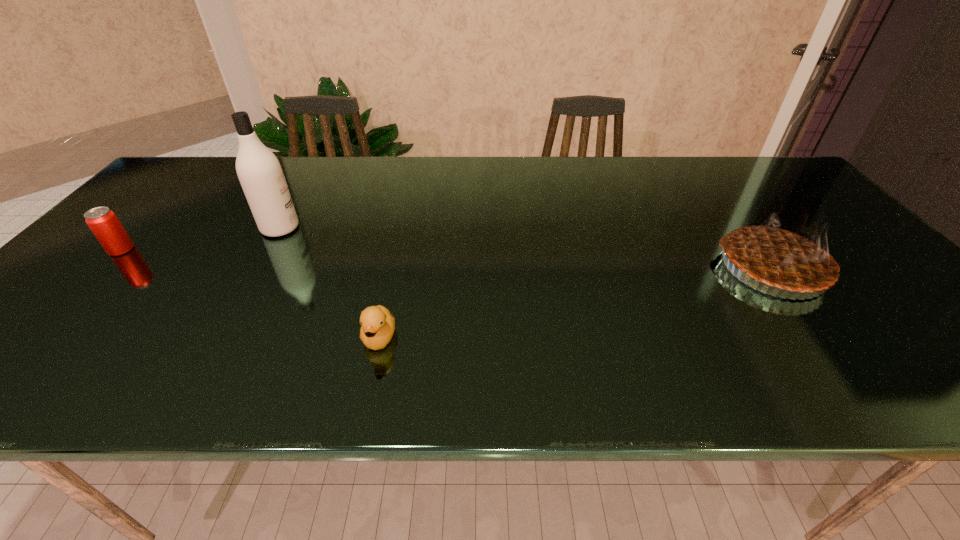
Find the location of a particular element. object that is the second closest to the pie is located at coordinates (259, 171).

Identify which object is located as the third nearest to the pie. Please provide its 2D coordinates. Your answer should be formatted as a tuple, i.e. [(x, y)], where the tuple contains the x and y coordinates of a point satisfying the conditions above.

[(103, 222)]

Where is `free point that satisfies the following two spatial constraints: 1. on the front-facing side of the second object from left to right; 2. on the left side of the second tallest object`? The height and width of the screenshot is (540, 960). free point that satisfies the following two spatial constraints: 1. on the front-facing side of the second object from left to right; 2. on the left side of the second tallest object is located at coordinates (257, 268).

The width and height of the screenshot is (960, 540). In order to click on blank area in the image that satisfies the following two spatial constraints: 1. on the front-facing side of the pie; 2. on the left side of the shampoo in this screenshot , I will do `click(257, 268)`.